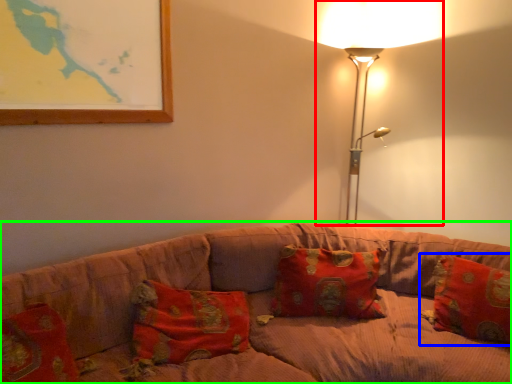
Question: Which object is positioned farthest from lamp (highlighted by a red box)? Select from pillow (highlighted by a blue box) and studio couch (highlighted by a green box).

Choices:
 (A) pillow
 (B) studio couch

Answer: (B)